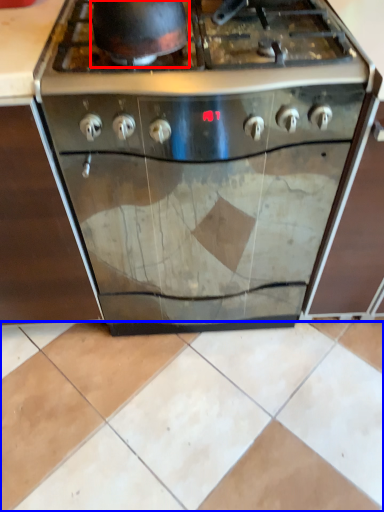
Question: Which point is closer to the camera, wok (highlighted by a red box) or ceramic tile (highlighted by a blue box)?

Choices:
 (A) wok
 (B) ceramic tile

Answer: (A)